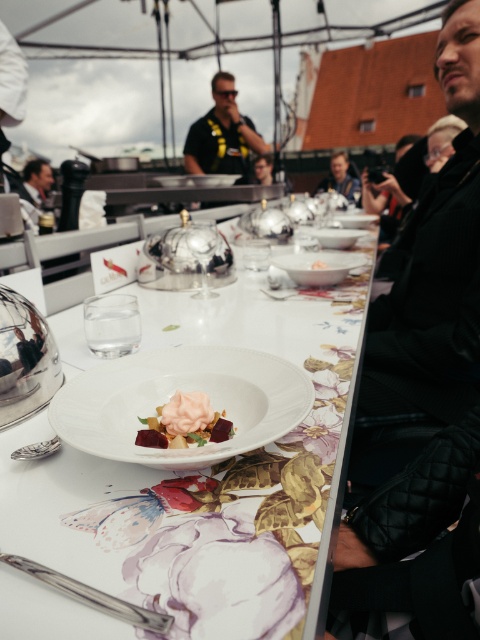
Can you confirm if white porcelain bowl at center is thinner than white glossy plate at center?

Indeed, white porcelain bowl at center has a lesser width compared to white glossy plate at center.

Which is more to the left, white porcelain bowl at center or white glossy plate at center?

white porcelain bowl at center

Describe the element at coordinates (172, 394) in the screenshot. I see `white porcelain bowl at center` at that location.

Identify the location of white porcelain bowl at center. This screenshot has width=480, height=640. (172, 394).

Is white porcelain bowl at center closer to the viewer compared to black jersey at center?

That is True.

Is white porcelain bowl at center to the left of black jersey at center from the viewer's perspective?

Incorrect, white porcelain bowl at center is not on the left side of black jersey at center.

Locate an element on the screen. white porcelain bowl at center is located at coordinates [172, 394].

Who is higher up, pink creamy dessert at center or white glossy bowl at center?

Positioned higher is white glossy bowl at center.

Is pink creamy dessert at center bigger than white glossy bowl at center?

Correct, pink creamy dessert at center is larger in size than white glossy bowl at center.

Which is in front, point (156, 435) or point (325, 268)?

Point (156, 435) is in front.

Locate an element on the screen. This screenshot has width=480, height=640. pink creamy dessert at center is located at coordinates (184, 422).